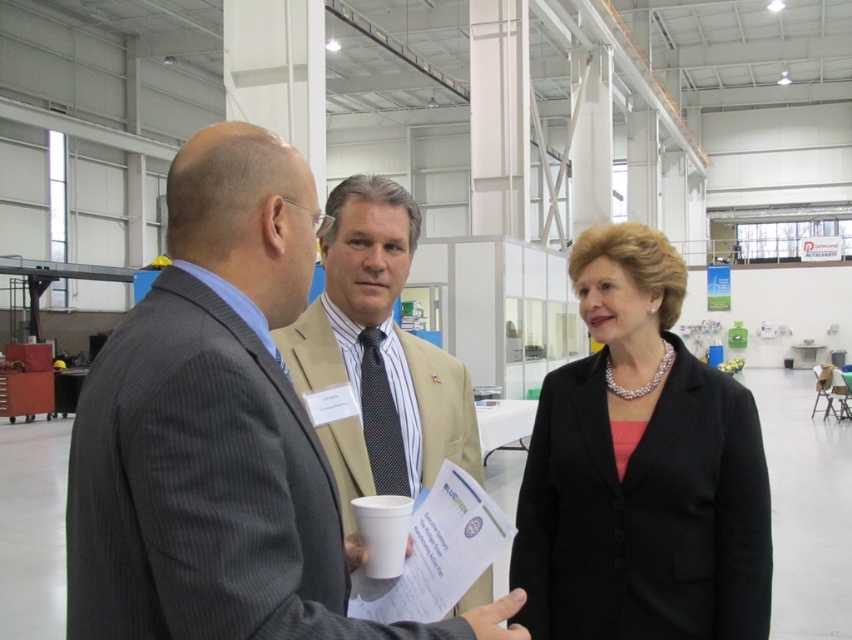
Question: Can you confirm if black satin blazer at center is positioned to the left of matte black suit at center?

Choices:
 (A) no
 (B) yes

Answer: (A)

Question: Among these objects, which one is farthest from the camera?

Choices:
 (A) beige fabric suit at center
 (B) gray pinstripe suit at center
 (C) black satin blazer at center

Answer: (C)

Question: Which of the following is the closest to the observer?

Choices:
 (A) black satin blazer at center
 (B) matte black suit at center
 (C) gray pinstripe suit at center
 (D) beige fabric suit at center

Answer: (C)

Question: Is black satin blazer at center to the left of beige fabric suit at center from the viewer's perspective?

Choices:
 (A) yes
 (B) no

Answer: (B)

Question: Is gray pinstripe suit at center above black satin blazer at center?

Choices:
 (A) yes
 (B) no

Answer: (B)

Question: Which object is closer to the camera taking this photo?

Choices:
 (A) gray pinstripe suit at center
 (B) beige fabric suit at center
 (C) black satin blazer at center
 (D) matte black suit at center

Answer: (A)